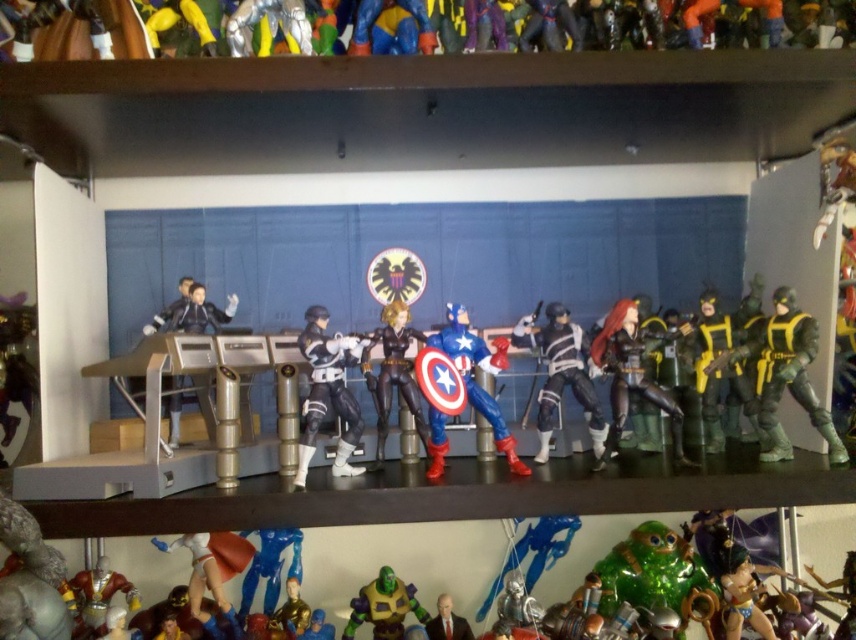
Does green rubber alien at lower center appear on the right side of smooth plastic superhero at lower center?

Yes, green rubber alien at lower center is to the right of smooth plastic superhero at lower center.

Is point (330, 593) closer to viewer compared to point (239, 628)?

No, it is behind (239, 628).

This screenshot has height=640, width=856. Identify the location of green rubber alien at lower center. (403, 561).

Image resolution: width=856 pixels, height=640 pixels. In order to click on black matte figure at center in this screenshot , I will do `click(328, 392)`.

Is point (355, 339) positioned after point (195, 292)?

No, (355, 339) is closer to viewer.

Find the location of a particular element. black matte figure at center is located at coordinates (328, 392).

Who is more forward, (548, 365) or (525, 474)?

Point (525, 474) is more forward.

Is matte black figure at center below shiny plastic captain america figure at center?

No, matte black figure at center is not below shiny plastic captain america figure at center.

You are a GUI agent. You are given a task and a screenshot of the screen. Output one action in this format:
    pyautogui.click(x=<x>, y=<y>)
    Task: Click on the matte black figure at center
    The width and height of the screenshot is (856, 640).
    Given the screenshot: What is the action you would take?
    pyautogui.click(x=562, y=374)

At what (x,y) coordinates should I click in order to perform the action: click on matte black figure at center. Please return your answer as a coordinate pair (x, y). The image size is (856, 640). Looking at the image, I should click on (562, 374).